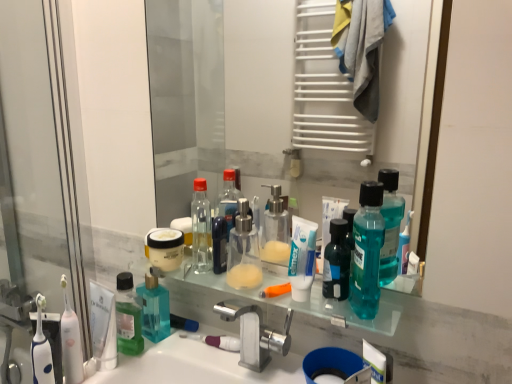
Question: Relative to transparent plastic screen door at left, is teal plastic mouthwash at center in front or behind?

Choices:
 (A) front
 (B) behind

Answer: (A)

Question: From the image's perspective, relative to transparent plastic screen door at left, is teal plastic mouthwash at center above or below?

Choices:
 (A) above
 (B) below

Answer: (B)

Question: Estimate the real-world distances between objects in this image. Which object is farther from the silver metallic faucet at center?

Choices:
 (A) white matte toothpaste at center
 (B) transparent glass mirror at center
 (C) white glossy sink at lower center
 (D) transparent plastic screen door at left
 (E) teal plastic mouthwash at center

Answer: (B)

Question: Which is farther from the silver metallic faucet at center?

Choices:
 (A) white matte toothpaste at center
 (B) transparent plastic screen door at left
 (C) white glossy sink at lower center
 (D) teal plastic mouthwash at center
 (E) transparent glass mirror at center

Answer: (E)